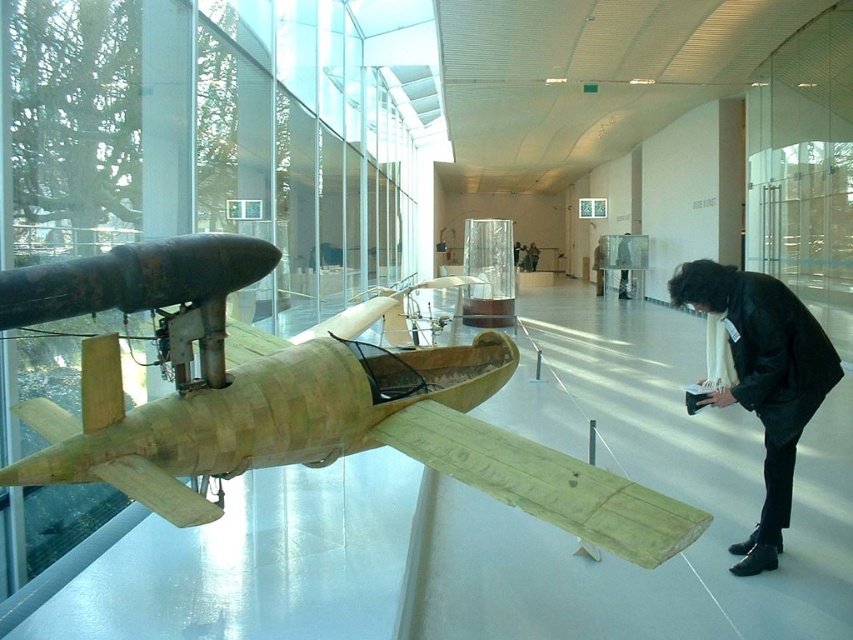
You are a visitor at the exhibition and want to take a photo of the wooden airplane at left without the black leather jacket at lower right appearing in the frame. Is this possible given their positions?

The wooden airplane at left is positioned over the black leather jacket at lower right, so taking a photo of the wooden airplane at left without the black leather jacket at lower right in the frame would require adjusting the angle or zoom to exclude the jacket, as they are vertically aligned.

You are a visitor in the museum and want to take a photo of the wooden airplane at left and the black leather jacket at lower right together in one frame. Based on their positions, which object should you focus on first to ensure both are in the shot?

You should focus on the wooden airplane at left first because it is positioned to the left of the black leather jacket at lower right, so centering the camera between them would capture both in the frame.

You are a visitor at the museum and want to take a photo of the wooden airplane at left and the black leather jacket at lower right together in the frame. Considering their sizes, which object should you move closer to in order to include both in the photo without cropping?

Since the wooden airplane at left is bigger than the black leather jacket at lower right, you should move closer to the wooden airplane at left to ensure both objects fit in the frame.